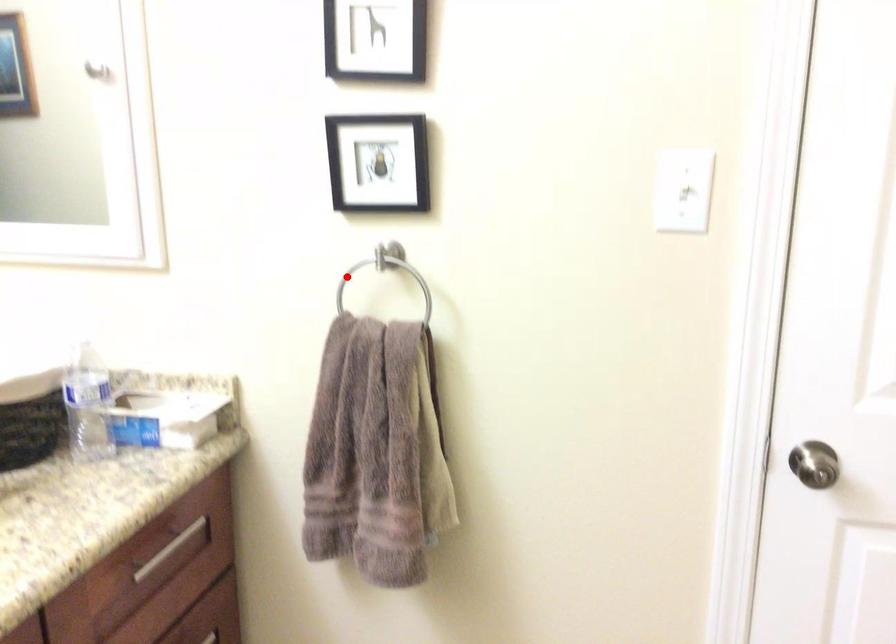
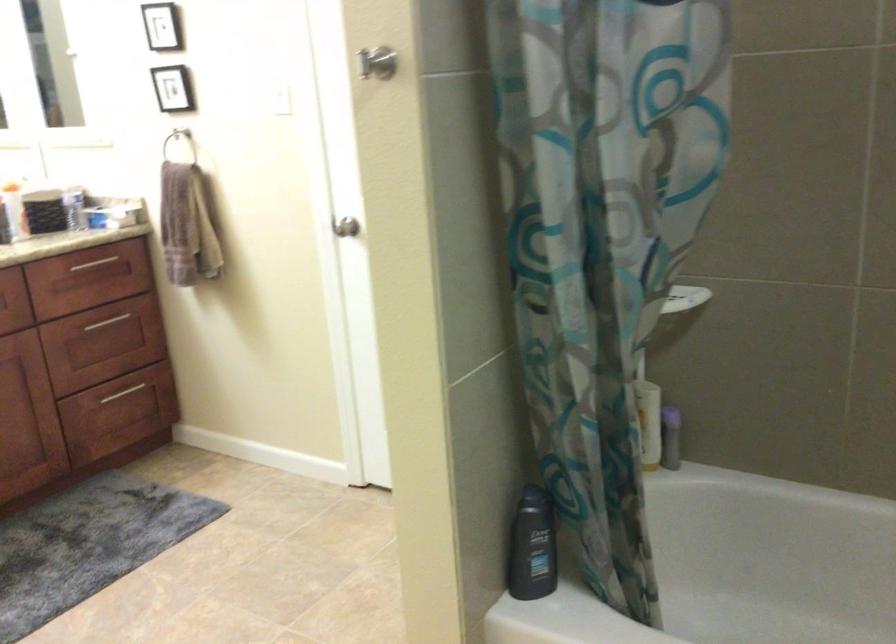
Question: I am providing you with two images of the same scene from different viewpoints. Given a red point in image1, look at the same physical point in image2. Is it:

Choices:
 (A) Closer to the viewpoint
 (B) Farther from the viewpoint

Answer: (B)